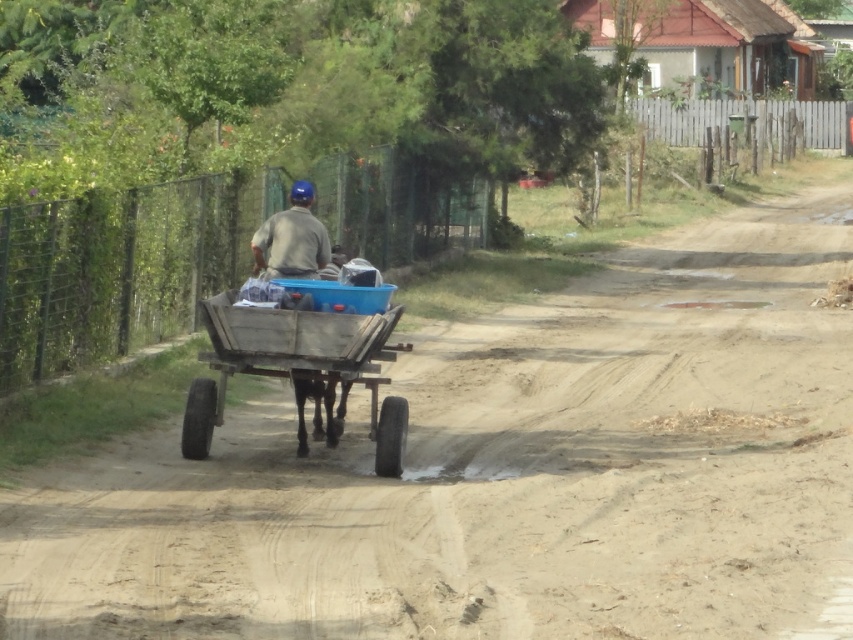
You are standing on the dirt road and want to walk from point (556, 433) to point (236, 371). Which direction should you move relative to the road?

You should move towards the lower left direction along the road because point (236, 371) is closer to the viewer than point (556, 433).